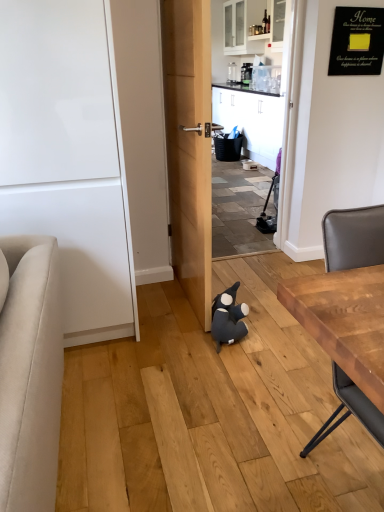
Question: Looking at their shapes, would you say wooden table at right is wider or thinner than white glossy door at left?

Choices:
 (A) thin
 (B) wide

Answer: (A)

Question: In terms of height, does wooden table at right look taller or shorter compared to white glossy door at left?

Choices:
 (A) tall
 (B) short

Answer: (B)

Question: Which is nearer to the dark blue plush toy at center?

Choices:
 (A) white glossy door at left
 (B) wooden table at right

Answer: (A)

Question: Estimate the real-world distances between objects in this image. Which object is closer to the white glossy door at left?

Choices:
 (A) wooden table at right
 (B) dark blue plush toy at center

Answer: (B)